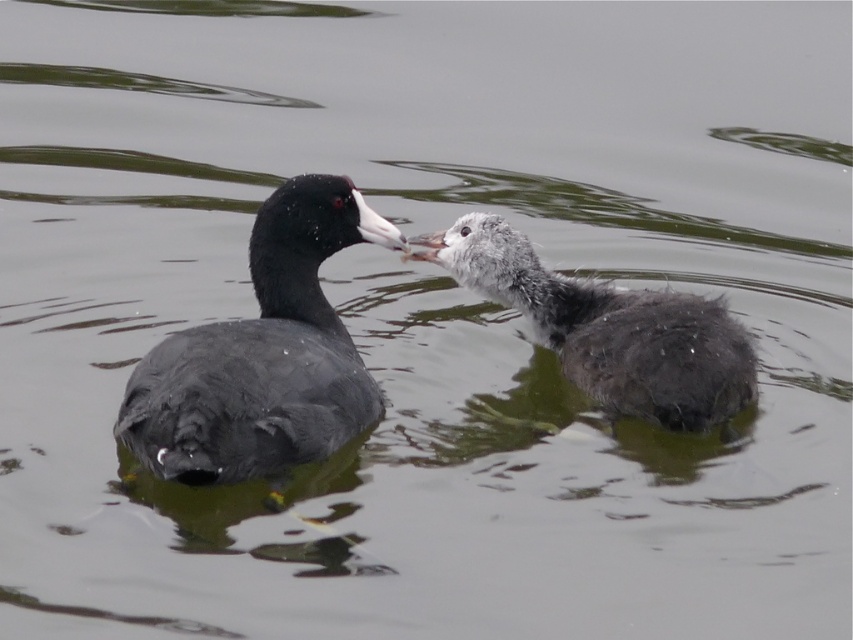
Is matte black duckling at left closer to the viewer compared to gray fluffy duckling at center?

That is True.

Can you confirm if matte black duckling at left is positioned above gray fluffy duckling at center?

No, matte black duckling at left is not above gray fluffy duckling at center.

Locate an element on the screen. matte black duckling at left is located at coordinates point(263,355).